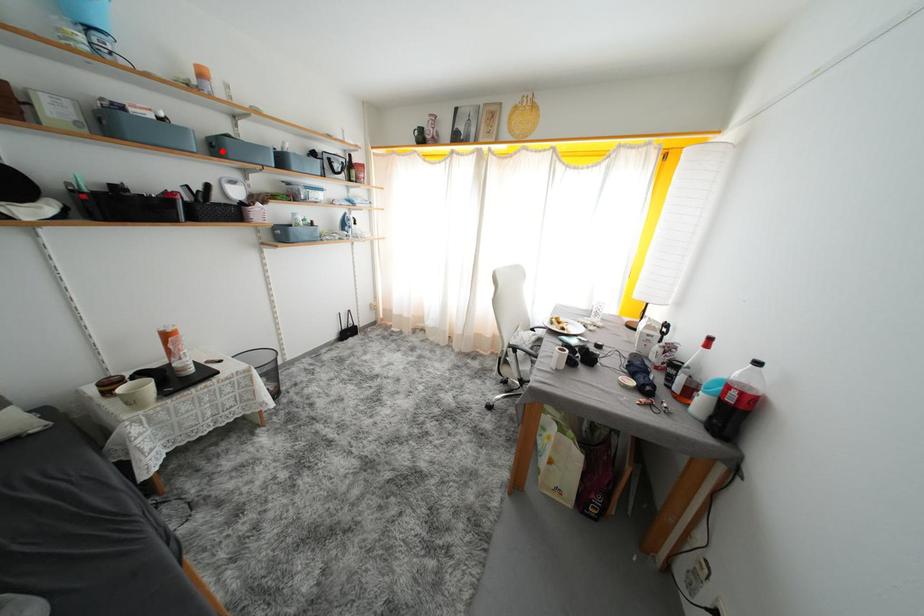
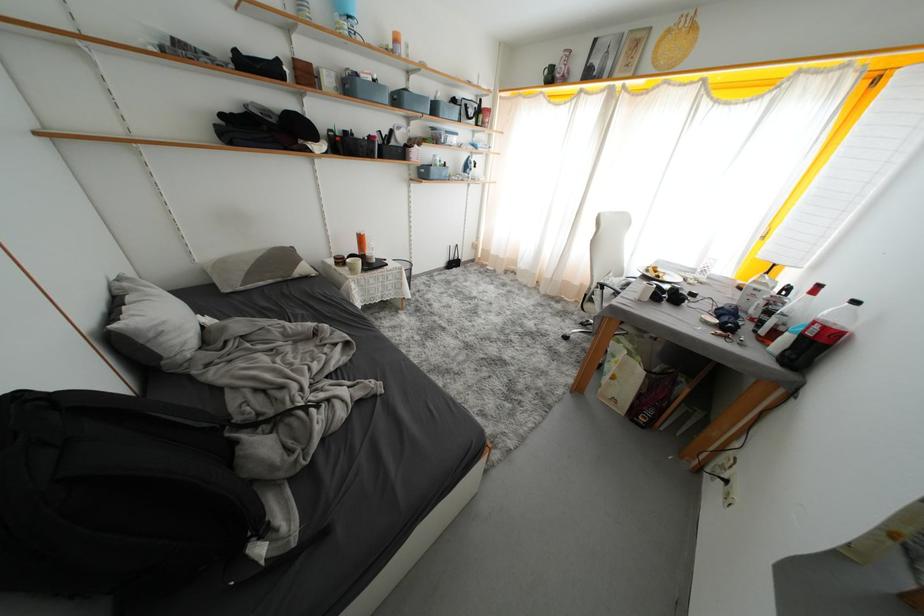
In the second image, find the point that corresponds to the highlighted location in the first image.

(404, 103)